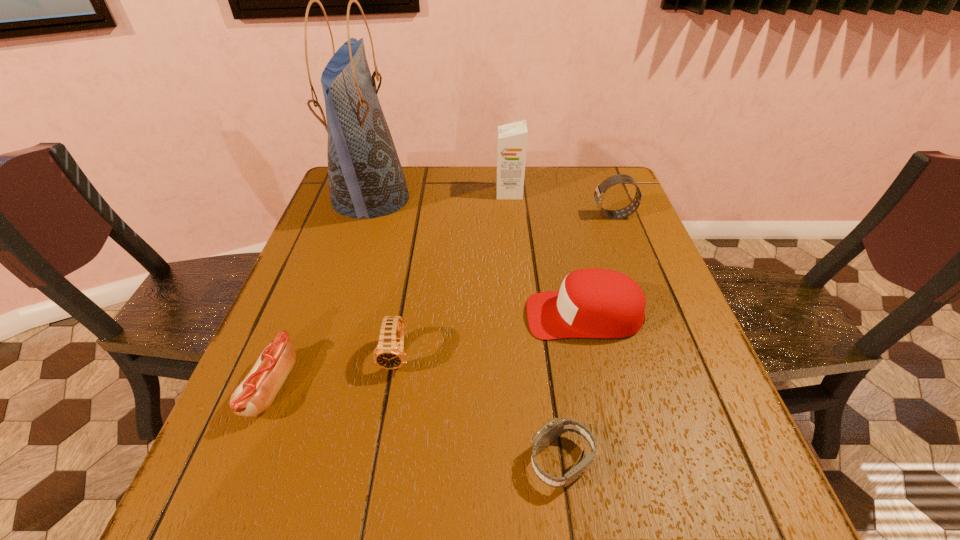
This screenshot has height=540, width=960. I want to click on vacant space located on the face of the nearest object, so click(x=359, y=461).

You are a GUI agent. You are given a task and a screenshot of the screen. Output one action in this format:
    pyautogui.click(x=<x>, y=<y>)
    Task: Click on the vacant space located 0.130m on the face of the nearest object
    This screenshot has height=540, width=960.
    Given the screenshot: What is the action you would take?
    pyautogui.click(x=450, y=461)

Locate an element on the screen. The image size is (960, 540). free space located on the back of the sausage is located at coordinates (310, 291).

The height and width of the screenshot is (540, 960). Find the location of `shopping bag positioned at the far edge`. shopping bag positioned at the far edge is located at coordinates (312, 539).

This screenshot has width=960, height=540. What are the coordinates of `carton situated at the far edge` in the screenshot? It's located at (312, 539).

At what (x,y) coordinates should I click in order to perform the action: click on object located at the near edge. Please return your answer as a coordinate pair (x, y). Image resolution: width=960 pixels, height=540 pixels. Looking at the image, I should click on (312, 539).

Locate an element on the screen. shopping bag positioned at the left edge is located at coordinates (312, 539).

At what (x,y) coordinates should I click in order to perform the action: click on sausage at the left edge. Please return your answer as a coordinate pair (x, y). The width and height of the screenshot is (960, 540). Looking at the image, I should click on (312, 539).

Locate an element on the screen. The height and width of the screenshot is (540, 960). watch located at the right edge is located at coordinates (312, 539).

Where is `baseball cap located at the right edge`? baseball cap located at the right edge is located at coordinates (312, 539).